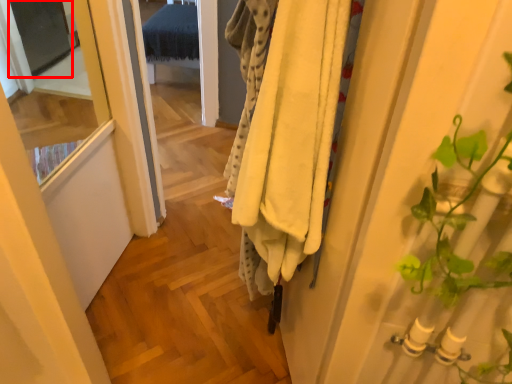
Question: From the image, what is the correct spatial relationship of screen door (annotated by the red box) in relation to clothing?

Choices:
 (A) left
 (B) right

Answer: (A)